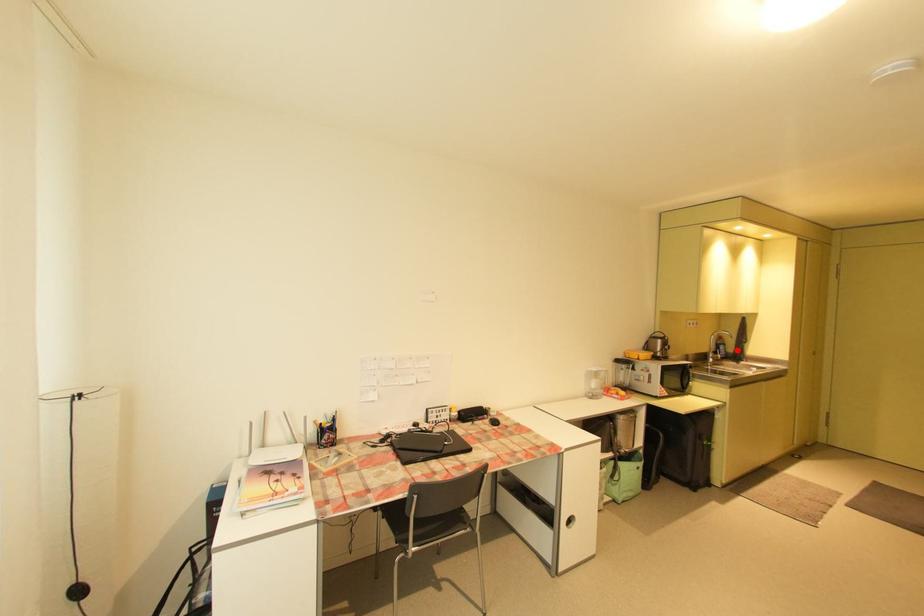
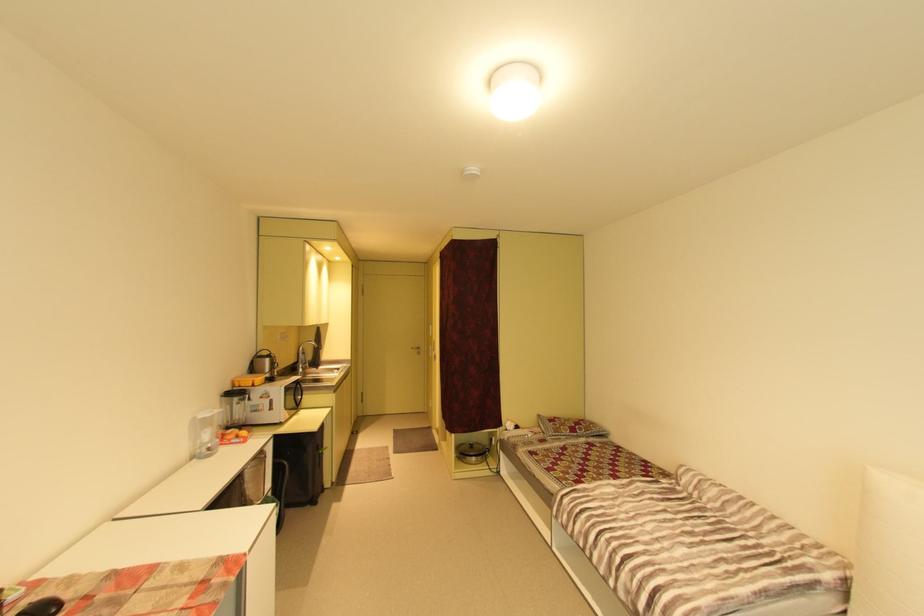
The point at the highlighted location is marked in the first image. Where is the corresponding point in the second image?

(317, 358)